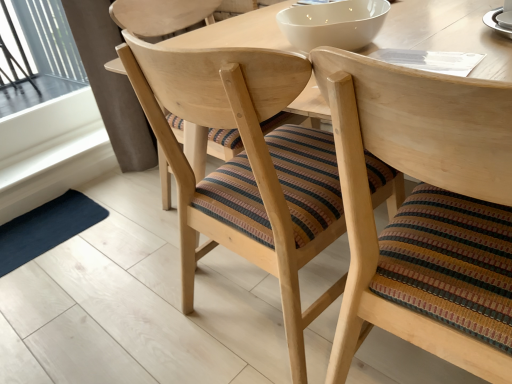
This screenshot has width=512, height=384. What are the coordinates of `vacant space situated on the left part of wooden chair with striped cushion at center, which is counted as the second chair, starting from the right` in the screenshot? It's located at (137, 307).